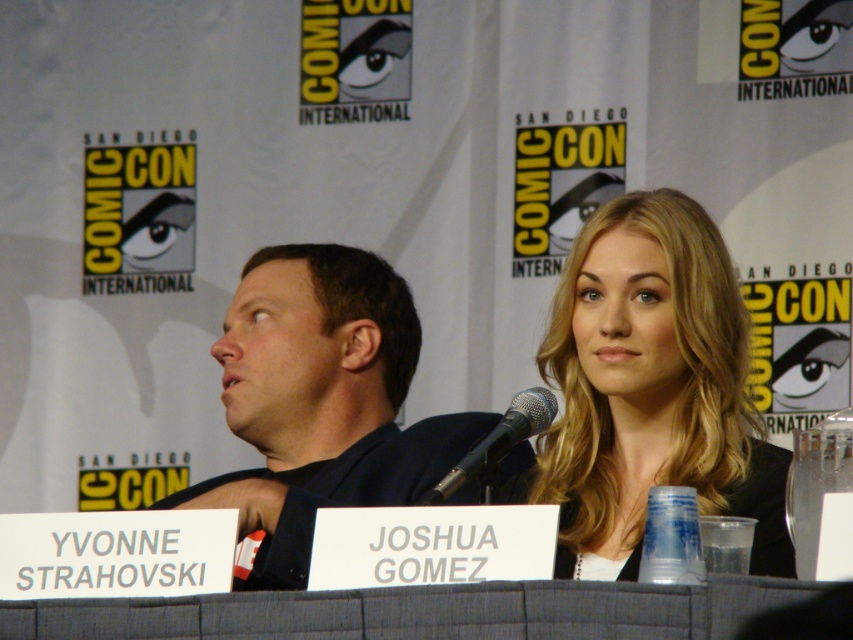
In the scene shown: Is dark blue shirt at left closer to camera compared to gray fabric table at center?

That is False.

Does dark blue shirt at left appear on the left side of gray fabric table at center?

Yes, dark blue shirt at left is to the left of gray fabric table at center.

Locate an element on the screen. dark blue shirt at left is located at coordinates (305, 394).

Is dark blue shirt at left in front of black metallic microphone at center?

No, dark blue shirt at left is behind black metallic microphone at center.

Identify the location of dark blue shirt at left. This screenshot has height=640, width=853. point(305,394).

Where is `dark blue shirt at left`? dark blue shirt at left is located at coordinates (305, 394).

Can you confirm if blonde hair at upper right is wider than dark blue shirt at left?

Yes.

Who is taller, blonde hair at upper right or dark blue shirt at left?

Standing taller between the two is blonde hair at upper right.

Find the location of a particular element. The image size is (853, 640). blonde hair at upper right is located at coordinates (651, 388).